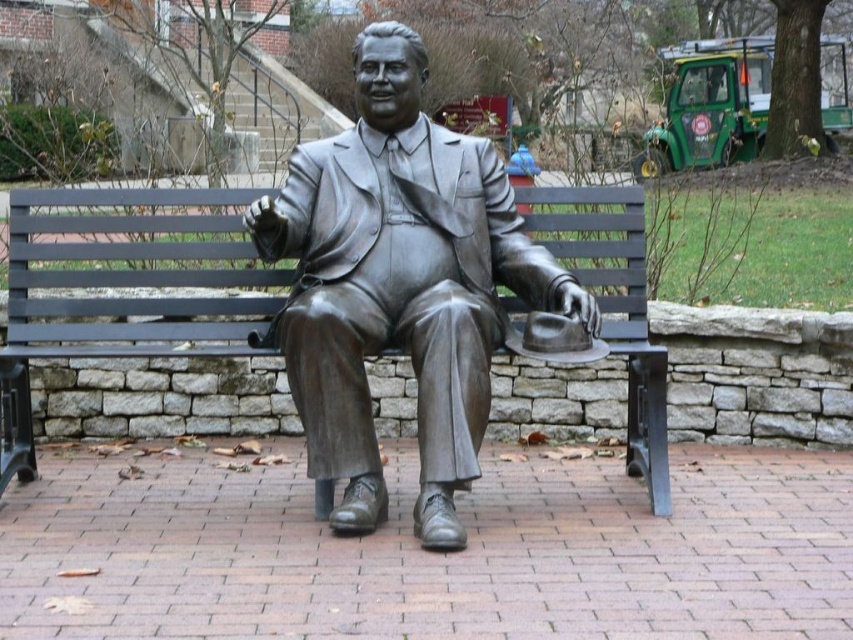
You are a city planner assessing the space around the bronze statue at center and the black metal bench at center. You need to install a new rectangular plaque that must fit entirely within the space currently occupied by either the statue or the bench. Based on their dimensions, which object can accommodate the plaque without overlapping?

The bronze statue at center might be wider than the black metal bench at center, so the statue could potentially accommodate the plaque if its width is sufficient, but there is uncertainty due to the comparative description using the word

You are standing in front of the bronze statue of a seated man on the black metal bench. You notice two points marked in the image at coordinates point [463,300] and point [33,470]. Which of these points is closer to you?

Point [463,300] is closer to the camera than point [33,470], so the point closer to you is point [463,300].

You are an artist planning to create a miniature version of the scene. The bronze statue at center and the black metal bench at center must be scaled down proportionally. If the original statue is 2 meters tall, what should be the height of the bench in the miniature if the statue is scaled to 10 cm?

The bronze statue at center is larger than the black metal bench at center. If the original statue is 2 meters tall and scaled down to 10 cm, the bench should be proportionally smaller. Since the statue is scaled by a factor of 10 cm per 200 cm, the scale is 1 cm to 20 cm. Therefore, the bench height would be half of the statue miniature height, so 5 cm.